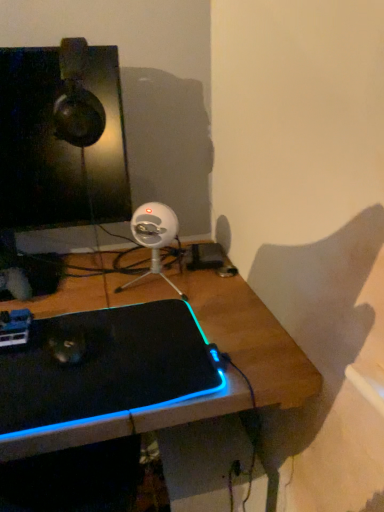
Question: From a real-world perspective, is white plastic webcam at center located higher than matte black monitor at upper left?

Choices:
 (A) no
 (B) yes

Answer: (A)

Question: Is white plastic webcam at center looking in the opposite direction of matte black monitor at upper left?

Choices:
 (A) no
 (B) yes

Answer: (A)

Question: Is matte black monitor at upper left inside white plastic webcam at center?

Choices:
 (A) no
 (B) yes

Answer: (A)

Question: Is white plastic webcam at center closer to camera compared to matte black monitor at upper left?

Choices:
 (A) no
 (B) yes

Answer: (A)

Question: Considering the relative positions of white plastic webcam at center and matte black monitor at upper left in the image provided, is white plastic webcam at center behind matte black monitor at upper left?

Choices:
 (A) no
 (B) yes

Answer: (B)

Question: Does white plastic webcam at center have a greater height compared to matte black monitor at upper left?

Choices:
 (A) yes
 (B) no

Answer: (B)

Question: Can you confirm if black matte laptop at center is wider than white plastic webcam at center?

Choices:
 (A) no
 (B) yes

Answer: (B)

Question: Does black matte laptop at center turn towards white plastic webcam at center?

Choices:
 (A) yes
 (B) no

Answer: (B)

Question: Is the depth of black matte laptop at center greater than that of white plastic webcam at center?

Choices:
 (A) yes
 (B) no

Answer: (B)

Question: Considering the relative sizes of black matte laptop at center and white plastic webcam at center in the image provided, is black matte laptop at center smaller than white plastic webcam at center?

Choices:
 (A) no
 (B) yes

Answer: (A)

Question: From the image's perspective, is black matte laptop at center on top of white plastic webcam at center?

Choices:
 (A) no
 (B) yes

Answer: (A)

Question: Is black matte laptop at center directly adjacent to white plastic webcam at center?

Choices:
 (A) yes
 (B) no

Answer: (B)

Question: From a real-world perspective, is black matte laptop at center on top of matte black monitor at upper left?

Choices:
 (A) no
 (B) yes

Answer: (A)